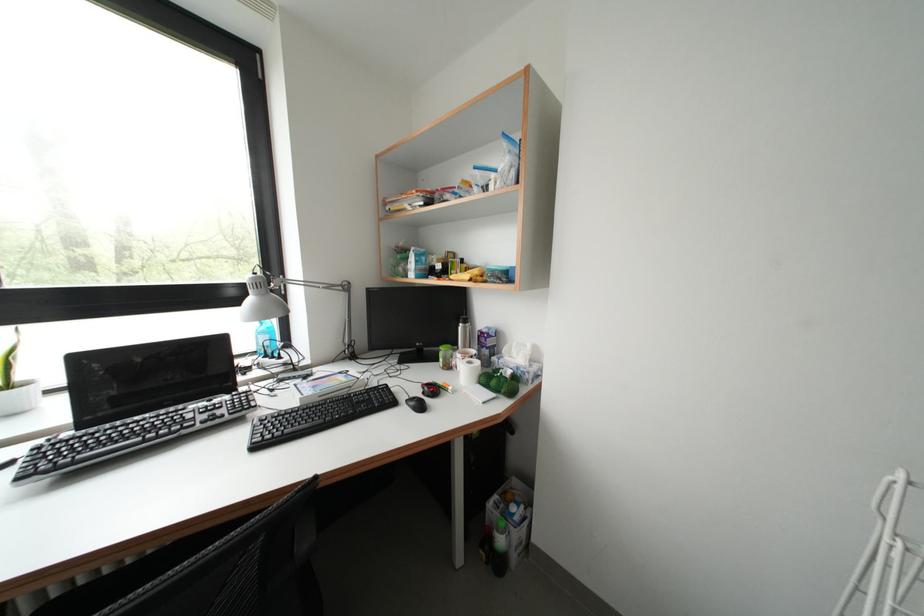
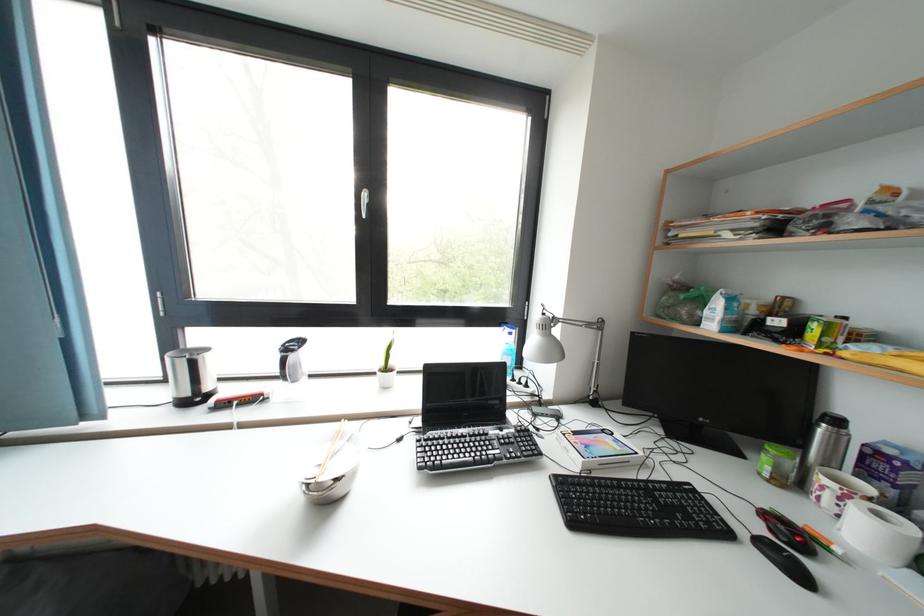
Question: The camera is either moving clockwise (left) or counter-clockwise (right) around the object. The first image is from the beginning of the video and the second image is from the end. Is the camera moving left or right when shooting the video?

Choices:
 (A) Left
 (B) Right

Answer: (B)